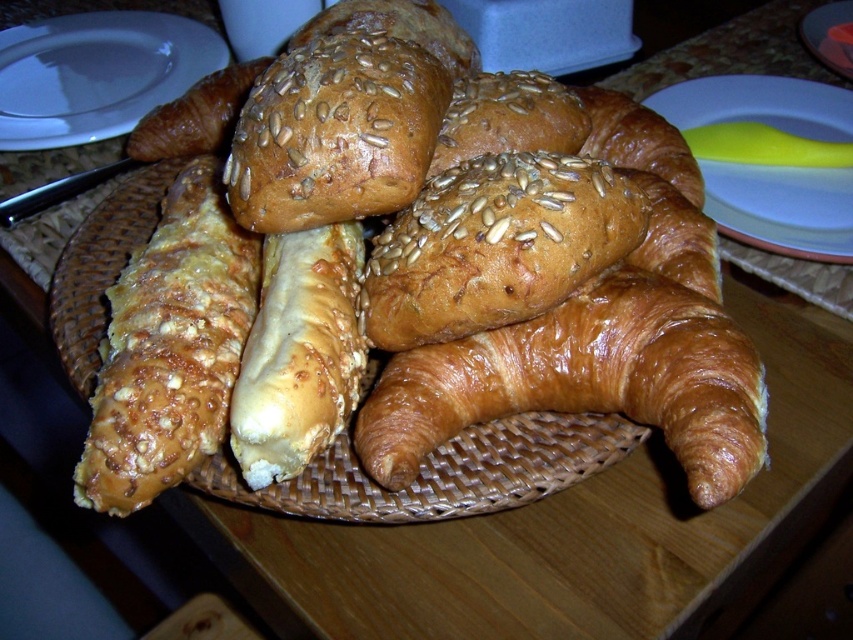
Question: Which object is the farthest from the slightly toasted croissant at center?

Choices:
 (A) blue glossy plate at upper right
 (B) golden-brown crusty bread at center
 (C) white glossy plate at upper center

Answer: (C)

Question: Which object is closer to the camera taking this photo?

Choices:
 (A) white ceramic plate at upper left
 (B) slightly toasted croissant at center
 (C) sesame seed-covered bread roll at center
 (D) shiny golden croissant at center

Answer: (D)

Question: Does shiny golden croissant at center have a lesser width compared to white glossy plate at upper center?

Choices:
 (A) no
 (B) yes

Answer: (A)

Question: Does golden-brown crusty bread at center come behind golden brown croissant at center?

Choices:
 (A) no
 (B) yes

Answer: (A)

Question: Is the position of white ceramic plate at upper left less distant than that of blue glossy plate at upper right?

Choices:
 (A) yes
 (B) no

Answer: (B)

Question: Based on their relative distances, which object is farther from the golden brown croissant at center?

Choices:
 (A) white ceramic plate at upper left
 (B) blue glossy plate at upper right
 (C) white glossy plate at upper center

Answer: (A)